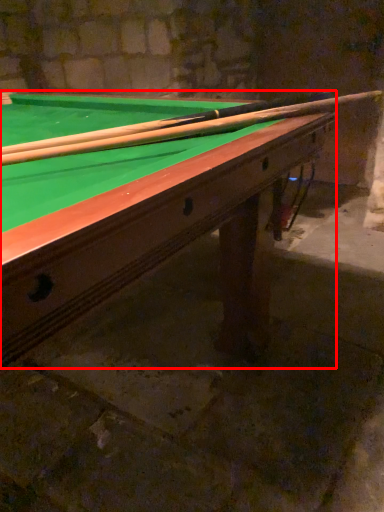
Question: Considering the relative positions of billiard table (annotated by the red box) and cue in the image provided, where is billiard table (annotated by the red box) located with respect to the staircase?

Choices:
 (A) left
 (B) right

Answer: (A)